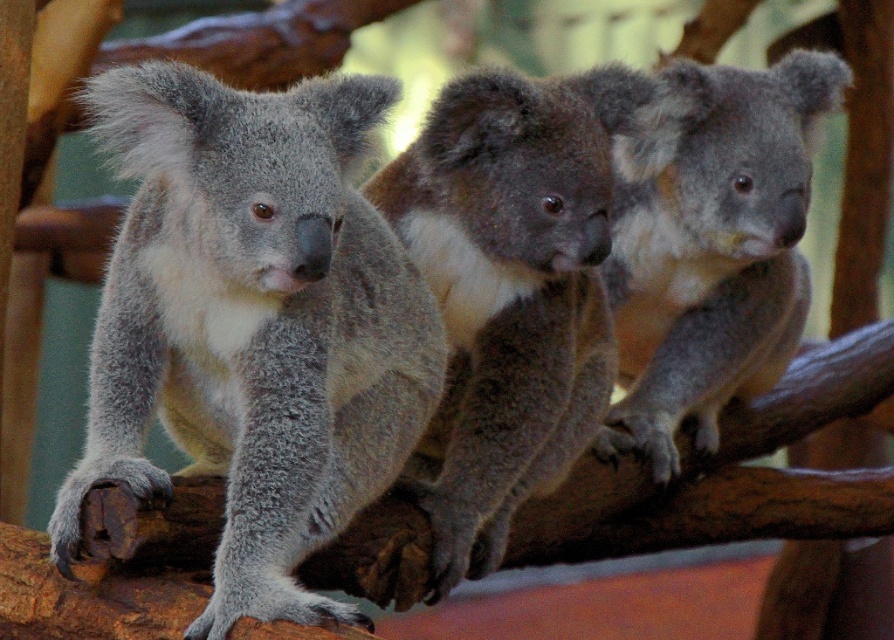
In the scene shown: You are observing three koalas on a branch in a zoo. You notice two points marked in the image, one at point (268, 516) and another at point (530, 340). Which of these points is closer to you?

Point (268, 516) is in front of point (530, 340), so it is closer to you.

You are a zookeeper who needs to prepare food portions for the gray fluffy koala at left and the gray furry koala at center. If the food portions depend on their size, which koala should receive a larger portion?

The gray fluffy koala at left should receive a larger portion because its width is larger than the gray furry koala at center.

You are a zookeeper observing the koalas in their enclosure. You need to place a food tray between the fuzzy gray koala at center and the gray furry koala at center. Based on their positions, which koala is wider so that you can position the tray appropriately?

The fuzzy gray koala at center is wider than the gray furry koala at center, so you should position the food tray accordingly to accommodate its width.